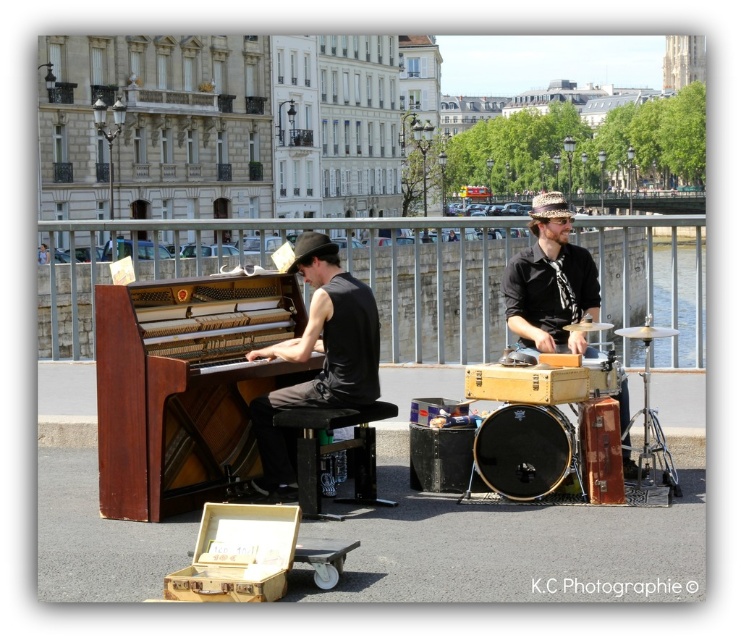
Where is `wooden piano at center`? wooden piano at center is located at coordinates (185, 387).

Who is more distant from viewer, (106, 448) or (305, 468)?

The point (305, 468) is more distant.

I want to click on wooden piano at center, so click(185, 387).

Does matte black piano at center have a greater width compared to black drum at center?

No, matte black piano at center is not wider than black drum at center.

Is matte black piano at center above black drum at center?

Correct, matte black piano at center is located above black drum at center.

Image resolution: width=741 pixels, height=640 pixels. What are the coordinates of `matte black piano at center` in the screenshot? It's located at (318, 349).

Is wooden drum set at right positioned before wooden drum at center?

Yes, wooden drum set at right is closer to the viewer.

Which is more to the left, wooden drum set at right or wooden drum at center?

Positioned to the left is wooden drum set at right.

Between point (516, 269) and point (605, 387), which one is positioned in front?

Point (605, 387) is in front.

Where is `wooden drum set at right`? Image resolution: width=741 pixels, height=640 pixels. wooden drum set at right is located at coordinates point(551,284).